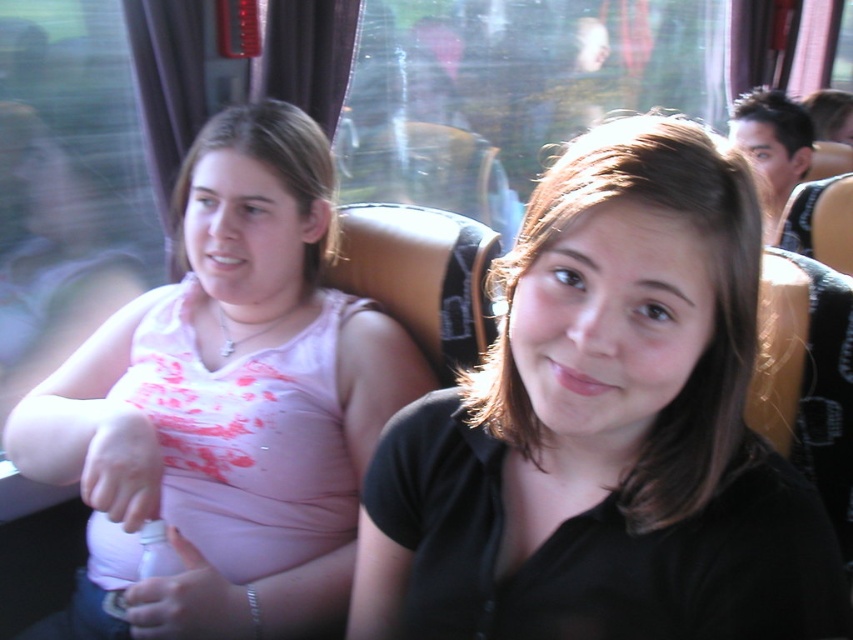
Between black matte shirt at center and pink matte tank top at center, which one appears on the left side from the viewer's perspective?

pink matte tank top at center is more to the left.

Measure the distance between black matte shirt at center and camera.

They are 19.94 inches apart.

Locate an element on the screen. This screenshot has height=640, width=853. black matte shirt at center is located at coordinates (605, 428).